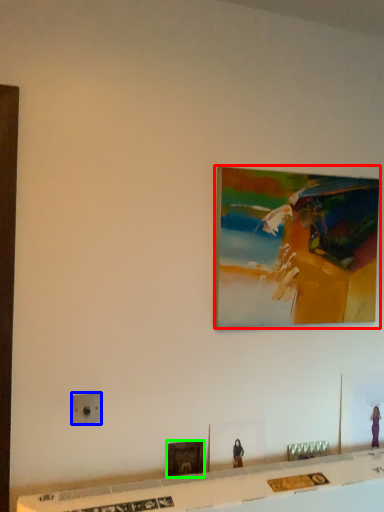
Question: Considering the real-world distances, which object is farthest from picture frame (highlighted by a red box)? electric outlet (highlighted by a blue box) or picture frame (highlighted by a green box)?

Choices:
 (A) electric outlet
 (B) picture frame

Answer: (A)